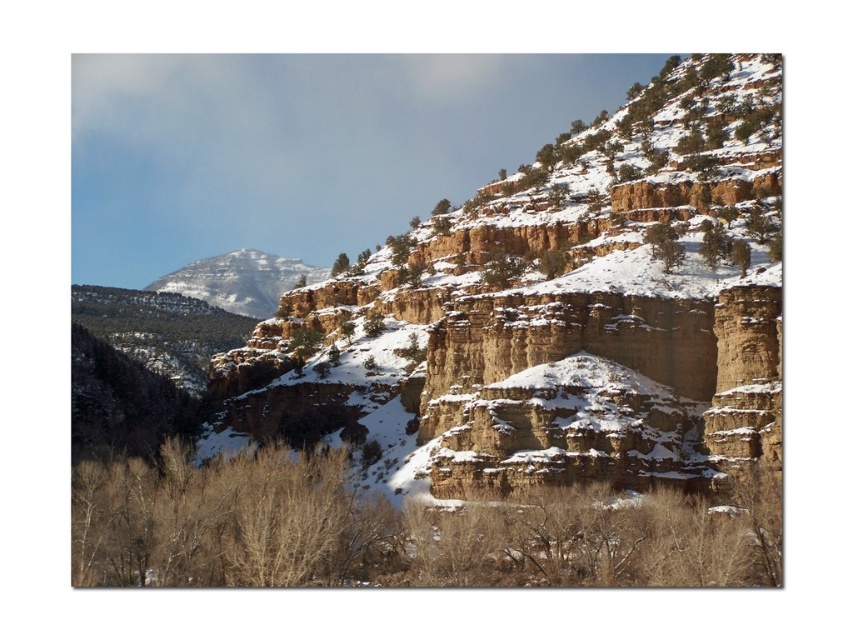
Question: Which of the following is the farthest from the observer?

Choices:
 (A) (544, 467)
 (B) (265, 316)

Answer: (B)

Question: Can you confirm if brown dry wood at lower center is positioned below green matte tree at upper center?

Choices:
 (A) no
 (B) yes

Answer: (B)

Question: Does white snow-covered mountain at upper left have a lesser width compared to green leafy shrub at upper center?

Choices:
 (A) yes
 (B) no

Answer: (B)

Question: Does rustic stone cliff at center appear on the left side of white snow-covered mountain at upper left?

Choices:
 (A) no
 (B) yes

Answer: (A)

Question: Which object is positioned farthest from the rustic stone cliff at center?

Choices:
 (A) white snow-covered mountain at upper left
 (B) green matte tree at upper center
 (C) green leafy shrub at upper center

Answer: (B)

Question: Which of the following is the closest to the observer?

Choices:
 (A) (x=648, y=230)
 (B) (x=144, y=529)
 (C) (x=287, y=289)
 (D) (x=329, y=268)

Answer: (B)